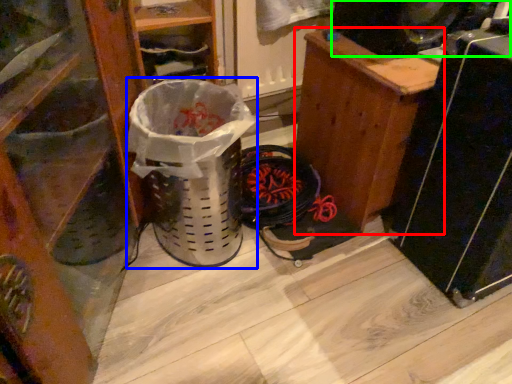
Question: Considering the real-world distances, which object is farthest from furniture (highlighted by a red box)? garbage (highlighted by a blue box) or speaker (highlighted by a green box)?

Choices:
 (A) garbage
 (B) speaker

Answer: (A)